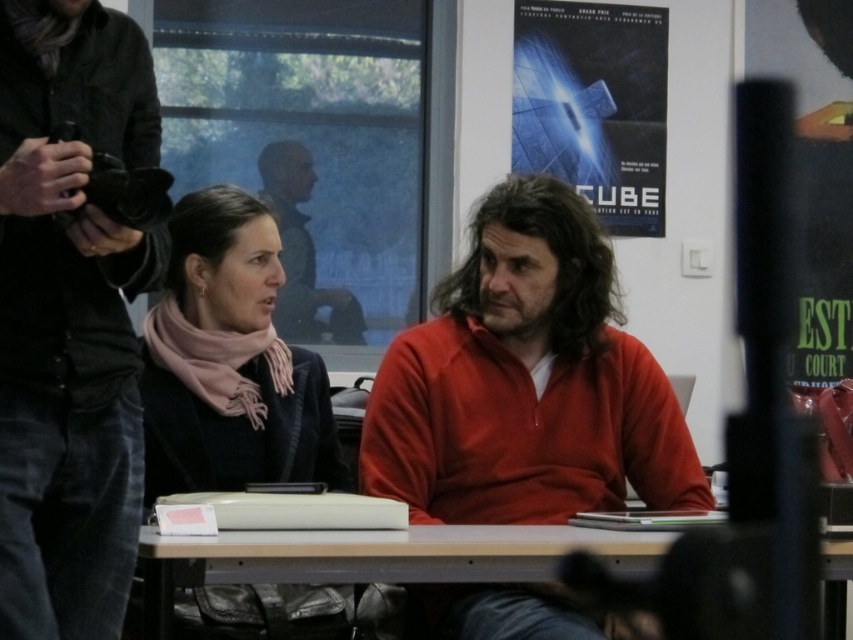
Is the position of matte red sweater at center more distant than that of pink scarf at center?

No, matte red sweater at center is closer to the viewer.

Who is more forward, (505, 499) or (248, 330)?

Point (505, 499) is more forward.

Identify the location of matte red sweater at center. (526, 381).

Between wooden table at center and matte black jacket at upper center, which one is positioned higher?

matte black jacket at upper center is higher up.

Does wooden table at center appear under matte black jacket at upper center?

Indeed, wooden table at center is positioned under matte black jacket at upper center.

This screenshot has height=640, width=853. In order to click on wooden table at center in this screenshot , I will do `click(376, 557)`.

Where is `wooden table at center`? The image size is (853, 640). wooden table at center is located at coordinates (376, 557).

Is blue glossy poster at upper center wider than wooden table at center?

Incorrect, blue glossy poster at upper center's width does not surpass wooden table at center's.

Between blue glossy poster at upper center and wooden table at center, which one has more height?

Standing taller between the two is blue glossy poster at upper center.

Locate an element on the screen. The width and height of the screenshot is (853, 640). blue glossy poster at upper center is located at coordinates (595, 106).